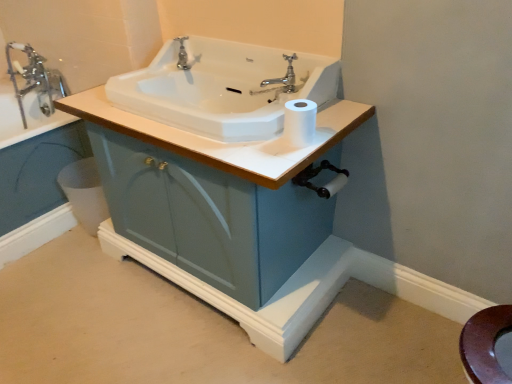
Identify the location of vacant space in front of white glossy bidet at lower left. Image resolution: width=512 pixels, height=384 pixels. (83, 253).